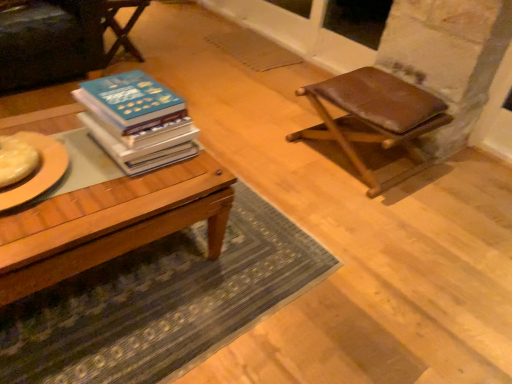
Where is `vacant space that is in between wooden chair at upper left and brown leather stool at right`? The height and width of the screenshot is (384, 512). vacant space that is in between wooden chair at upper left and brown leather stool at right is located at coordinates (236, 106).